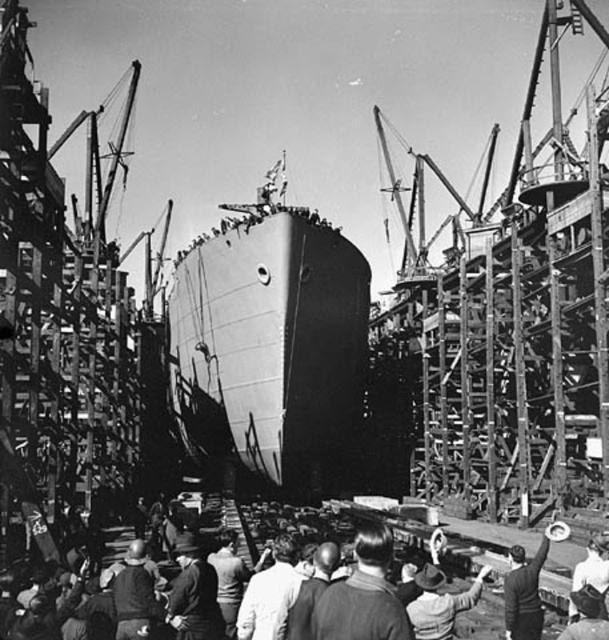
Based on the photo, you are standing at the entrance of the shipyard and want to locate the dark gray shirt at center. According to the coordinates provided, in which direction should you look to find it?

The dark gray shirt at center is located at point (364, 595), which corresponds to the lower right direction from your current position at the entrance.

You are a crane operator trying to lift a heavy object from the smooth gray ship at center to the light gray fabric jacket at center. What is the minimum required length of the crane boom to complete this task?

The smooth gray ship at center and the light gray fabric jacket at center are 62.66 meters apart from each other, so the crane boom must be at least 62.66 meters long to reach between them.

You are a worker in the shipyard and you want to place a safety sign on the dark gray shirt at center so that it can also be seen from the white cloth hat at center. Is the safety sign visible from there?

The dark gray shirt at center is positioned over the white cloth hat at center, so the safety sign placed on the dark gray shirt at center would be visible from the white cloth hat at center as it is directly above it.